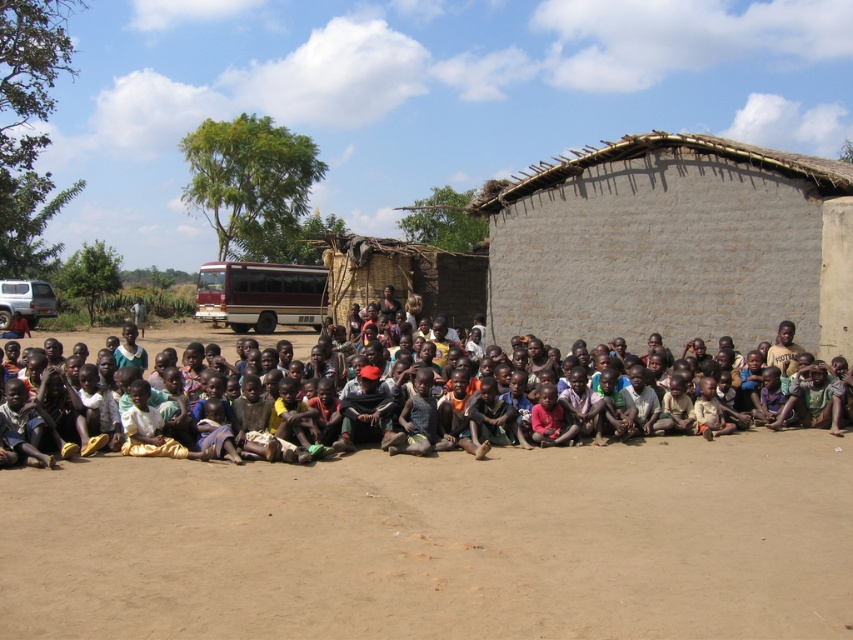
Question: Can you confirm if white matte school bus at upper left is wider than dark brown skin at center?

Choices:
 (A) no
 (B) yes

Answer: (A)

Question: Does white matte school bus at upper left have a lesser width compared to dark brown skin at center?

Choices:
 (A) yes
 (B) no

Answer: (A)

Question: Which point appears farthest from the camera in this image?

Choices:
 (A) (842, 522)
 (B) (254, 304)
 (C) (705, 227)

Answer: (B)

Question: Which object is farther from the camera taking this photo?

Choices:
 (A) gray mud hut at right
 (B) dark brown skin at center

Answer: (A)

Question: Which point is closer to the camera?

Choices:
 (A) (177, 340)
 (B) (631, 472)

Answer: (B)

Question: Can you confirm if gray mud hut at right is positioned above dark brown skin at center?

Choices:
 (A) no
 (B) yes

Answer: (B)